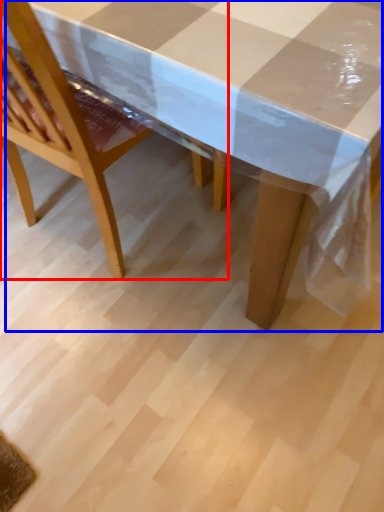
Question: Which of the following is the closest to the observer, chair (highlighted by a red box) or picnic table (highlighted by a blue box)?

Choices:
 (A) chair
 (B) picnic table

Answer: (B)